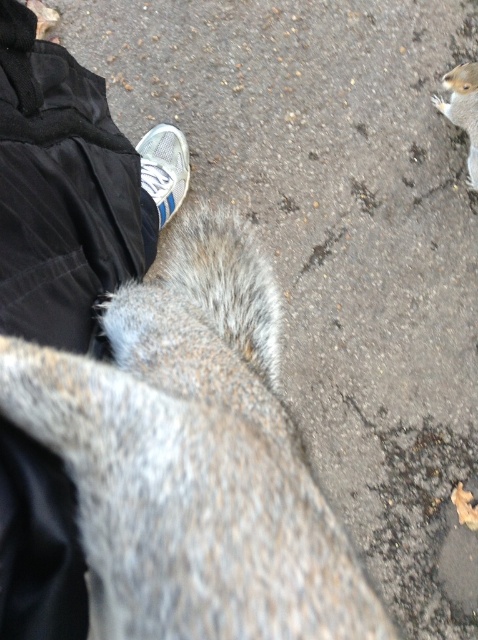
Question: Which point appears closest to the camera in this image?

Choices:
 (A) (43, 115)
 (B) (453, 81)

Answer: (A)

Question: Does white mesh shoe at center have a greater width compared to gray furry squirrel at upper right?

Choices:
 (A) yes
 (B) no

Answer: (A)

Question: Is black fabric shoe at lower left bigger than white mesh shoe at center?

Choices:
 (A) yes
 (B) no

Answer: (A)

Question: Which point is farther to the camera?

Choices:
 (A) (452, 81)
 (B) (147, 141)
 (C) (7, 259)

Answer: (B)

Question: Can you confirm if black fabric shoe at lower left is bigger than gray furry squirrel at upper right?

Choices:
 (A) no
 (B) yes

Answer: (B)

Question: Among these points, which one is nearest to the camera?

Choices:
 (A) (10, 291)
 (B) (156, 164)
 (C) (470, 120)

Answer: (A)